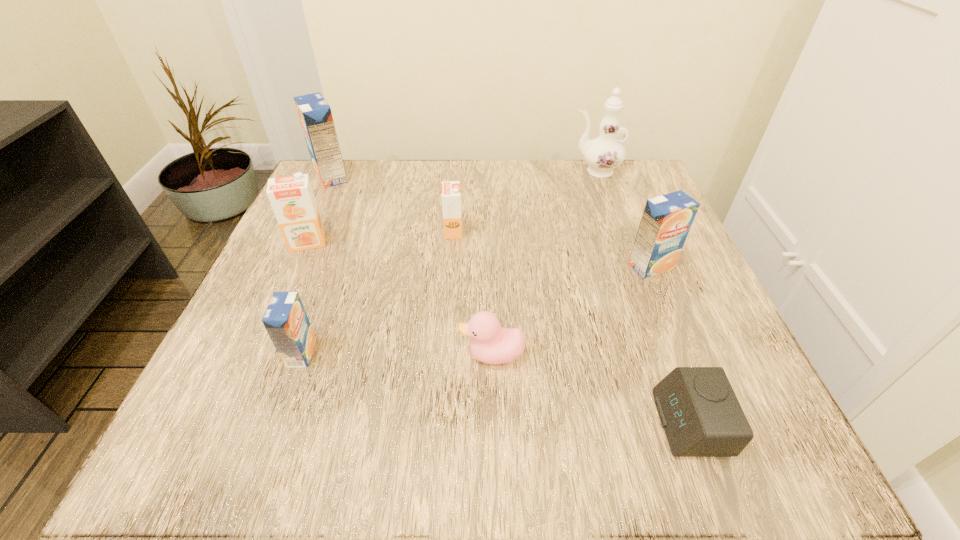
Where is `chinaware`? chinaware is located at coordinates tap(604, 153).

The width and height of the screenshot is (960, 540). Identify the location of the farthest blue orange_juice. (315, 115).

In order to click on the farthest orange juice in this screenshot , I will do `click(315, 115)`.

At what (x,y) coordinates should I click in order to perform the action: click on the left orange orange juice. Please return your answer as a coordinate pair (x, y). Looking at the image, I should click on (292, 199).

What are the coordinates of `the second smallest blue orange_juice` in the screenshot? It's located at (666, 220).

Where is `the rightmost blue orange_juice`? This screenshot has width=960, height=540. the rightmost blue orange_juice is located at coordinates (666, 220).

Where is `the smallest blue orange_juice`? the smallest blue orange_juice is located at coordinates (285, 319).

Find the location of `the third orange juice from right to left`. the third orange juice from right to left is located at coordinates (285, 319).

The image size is (960, 540). I want to click on the right orange orange juice, so click(x=451, y=195).

Image resolution: width=960 pixels, height=540 pixels. What are the coordinates of `the second orange juice from right to left` in the screenshot? It's located at (451, 195).